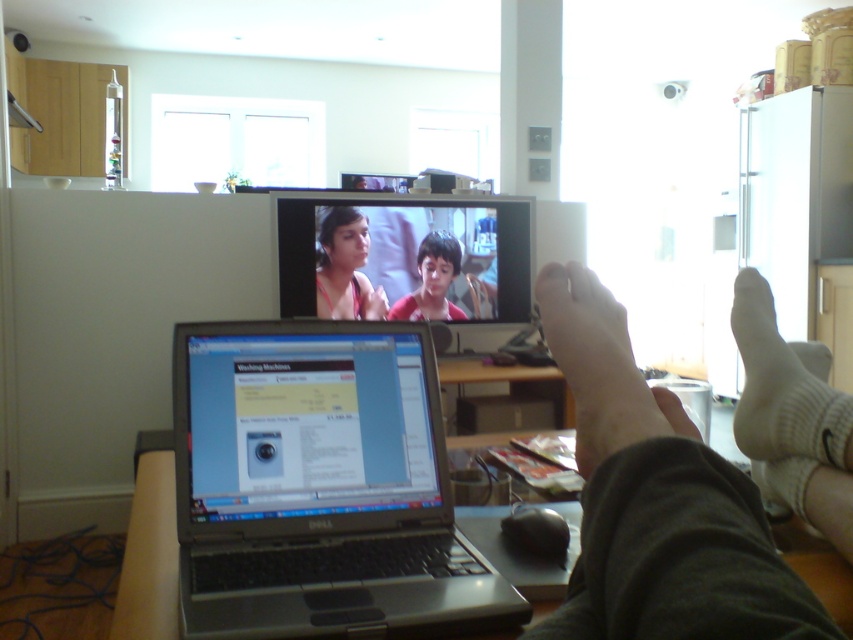
Is white soft foot at lower right to the right of matte red shirt at center from the viewer's perspective?

Indeed, white soft foot at lower right is positioned on the right side of matte red shirt at center.

Between white soft foot at lower right and matte red shirt at center, which one has less height?

Standing shorter between the two is white soft foot at lower right.

Identify the location of white soft foot at lower right. (595, 364).

Does silver metallic laptop at center have a greater height compared to matte red shirt at center?

In fact, silver metallic laptop at center may be shorter than matte red shirt at center.

Is silver metallic laptop at center above matte red shirt at center?

Actually, silver metallic laptop at center is below matte red shirt at center.

The height and width of the screenshot is (640, 853). What do you see at coordinates (318, 486) in the screenshot?
I see `silver metallic laptop at center` at bounding box center [318, 486].

Locate an element on the screen. Image resolution: width=853 pixels, height=640 pixels. silver metallic laptop at center is located at coordinates (318, 486).

Can you confirm if silver metallic laptop at center is positioned to the left of matte plastic television at upper center?

Yes, silver metallic laptop at center is to the left of matte plastic television at upper center.

Describe the element at coordinates (318, 486) in the screenshot. Image resolution: width=853 pixels, height=640 pixels. I see `silver metallic laptop at center` at that location.

Is point (280, 554) more distant than point (457, 330)?

No, it is in front of (457, 330).

Find the location of `silver metallic laptop at center`. silver metallic laptop at center is located at coordinates (318, 486).